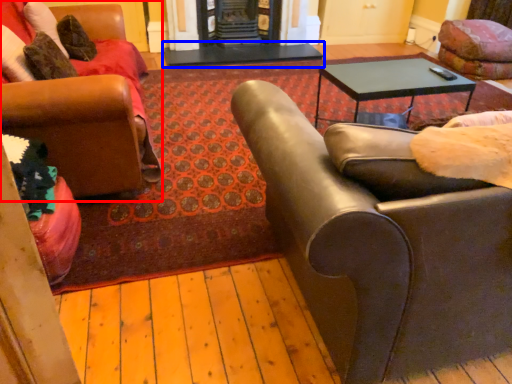
Question: Which point is further to the camera, chair (highlighted by a red box) or table (highlighted by a blue box)?

Choices:
 (A) chair
 (B) table

Answer: (B)